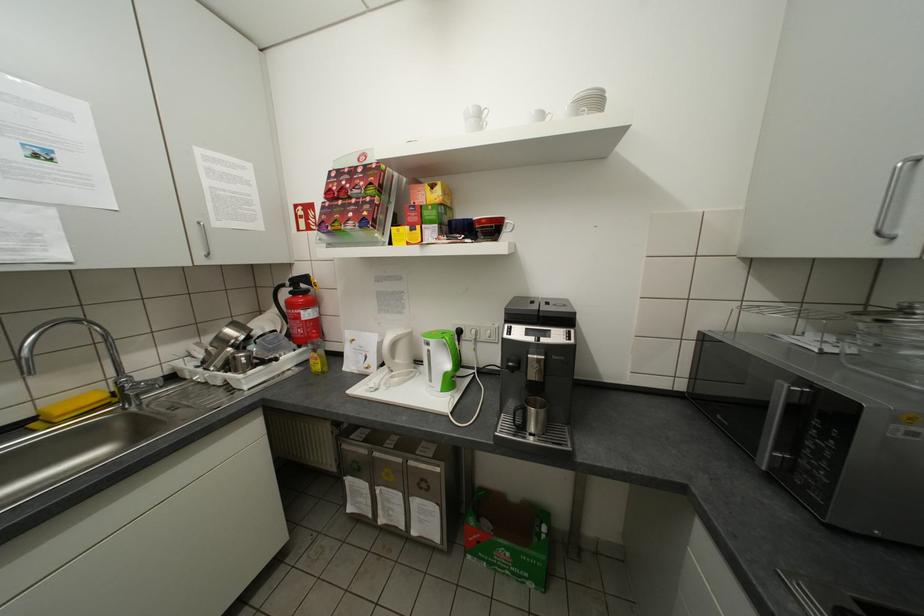
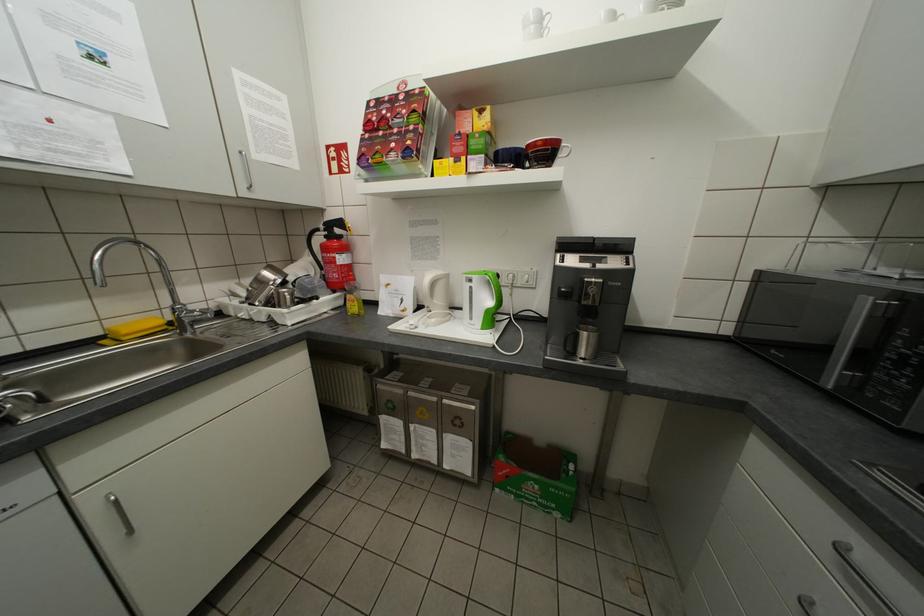
Find the pixel in the second image that matches pixel 386 334 in the first image.

(423, 277)